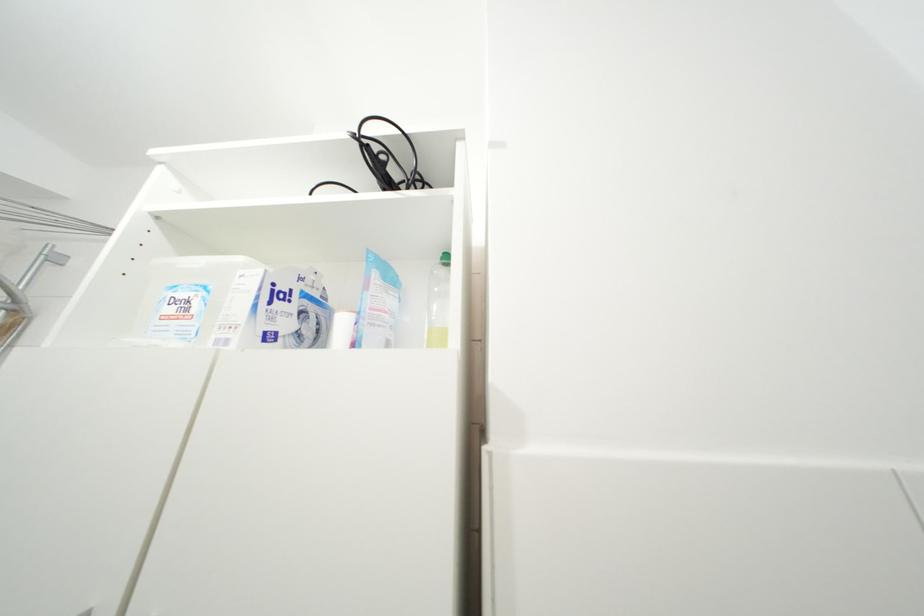
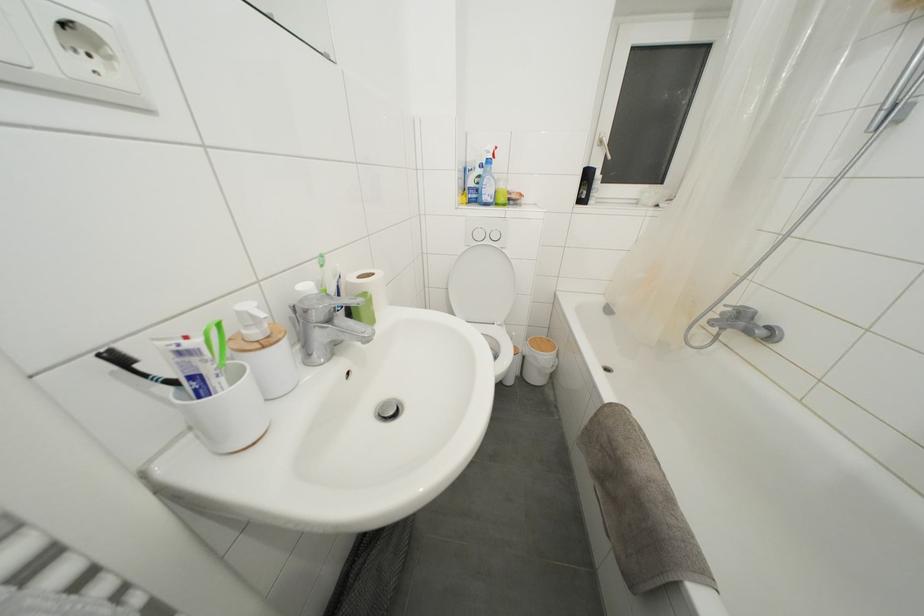
The images are taken continuously from a first-person perspective. In which direction is your viewpoint rotating?

The camera rotated toward left-down.